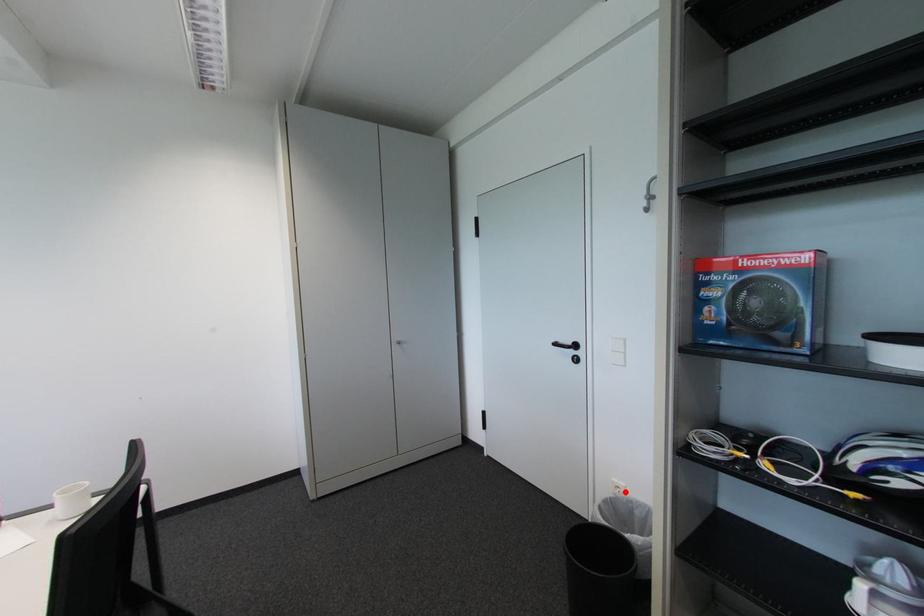
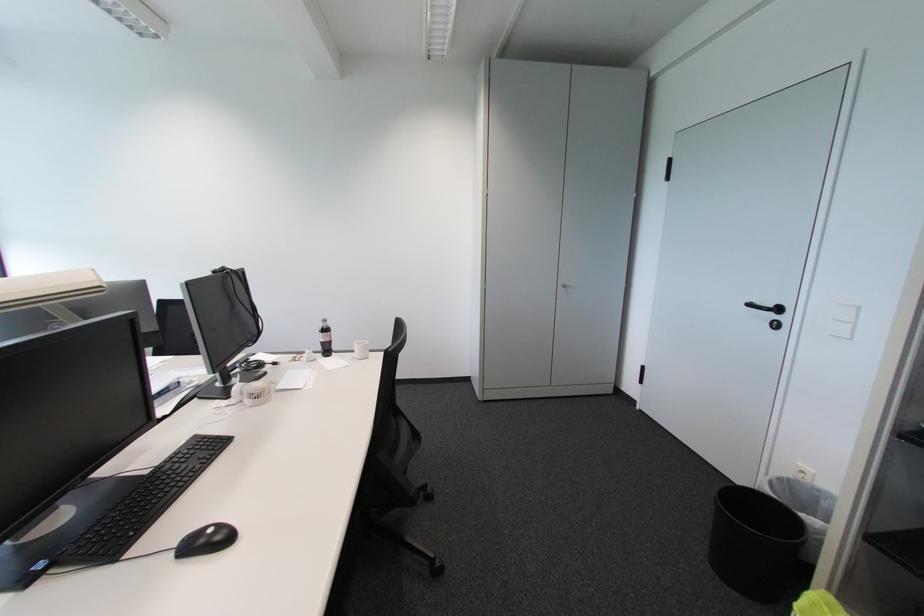
Locate, in the second image, the point that corresponds to the highlighted location in the first image.

(809, 477)